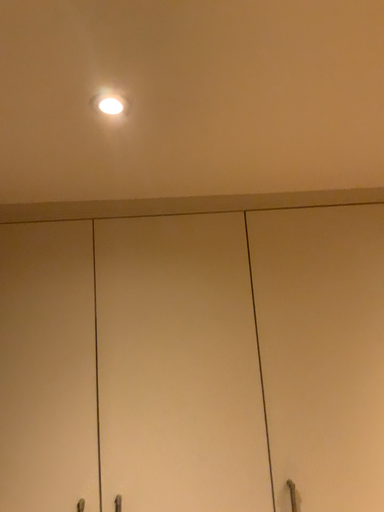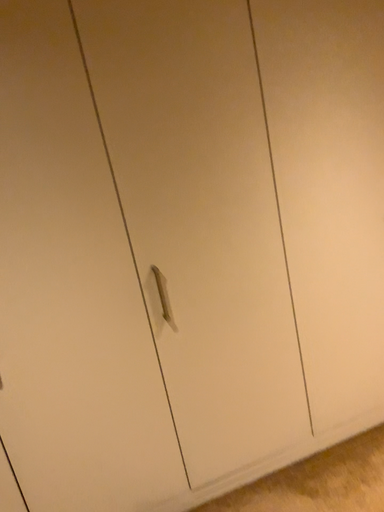
Question: How did the camera likely rotate when shooting the video?

Choices:
 (A) rotated left
 (B) rotated right

Answer: (B)